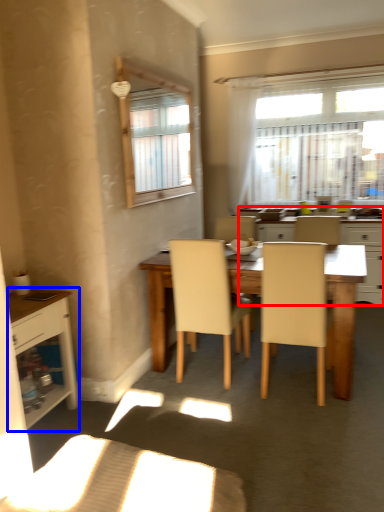
Question: Which of the following is the closest to the observer, kitchen & dining room table (highlighted by a red box) or cabinetry (highlighted by a blue box)?

Choices:
 (A) kitchen & dining room table
 (B) cabinetry

Answer: (B)